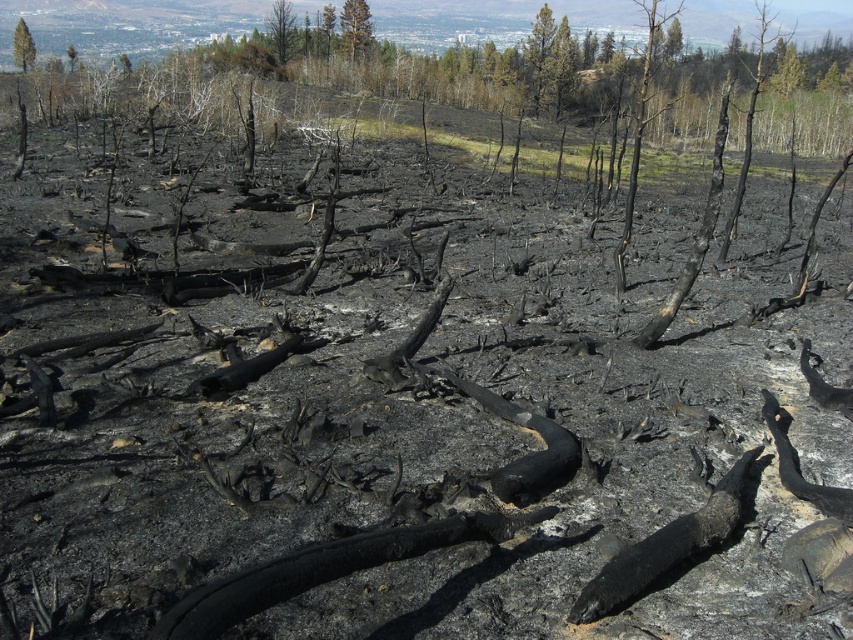
Question: Which object appears farthest from the camera in this image?

Choices:
 (A) charcoal bark tree at upper center
 (B) green textured tree at upper center
 (C) green matte tree at upper center
 (D) charred wood tree at upper left

Answer: (B)

Question: Does green textured tree at upper center lie in front of green matte tree at upper center?

Choices:
 (A) yes
 (B) no

Answer: (B)

Question: Which point is farther to the camera?

Choices:
 (A) green textured tree at upper center
 (B) charcoal bark tree at upper center

Answer: (A)

Question: Can you confirm if charcoal bark tree at upper center is positioned to the right of green textured tree at upper center?

Choices:
 (A) no
 (B) yes

Answer: (B)

Question: Which of the following is the farthest from the observer?

Choices:
 (A) (283, 42)
 (B) (646, 44)
 (C) (71, 58)
 (D) (27, 49)

Answer: (B)

Question: Does green textured tree at upper center appear under green leafy tree at upper left?

Choices:
 (A) no
 (B) yes

Answer: (A)